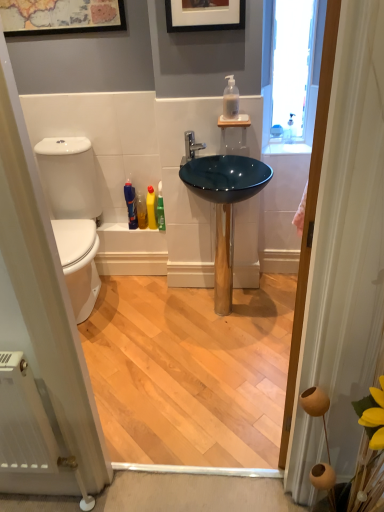
Question: Considering the positions of translucent glass soap dispenser at upper right and translucent plastic bottles at lower center, placed as the 4th toiletry when sorted from right to left, in the image, is translucent glass soap dispenser at upper right bigger or smaller than translucent plastic bottles at lower center, placed as the 4th toiletry when sorted from right to left,?

Choices:
 (A) small
 (B) big

Answer: (B)

Question: From the image's perspective, relative to translucent plastic bottles at lower center, which is counted as the first toiletry, starting from the left, is translucent glass soap dispenser at upper right above or below?

Choices:
 (A) below
 (B) above

Answer: (B)

Question: Which is nearer to the yellow plastic bottle at lower center, which is the 2th toiletry from right to left?

Choices:
 (A) translucent plastic bottles at lower center, which is counted as the first toiletry, starting from the left
 (B) green glossy bottle at center, which is the 4th toiletry from left to right
 (C) polished chrome faucet at center
 (D) translucent plastic soap dispenser at upper center
 (E) translucent glass soap dispenser at upper right

Answer: (B)

Question: Estimate the real-world distances between objects in this image. Which object is farther from the translucent plastic soap dispenser at upper center?

Choices:
 (A) polished chrome faucet at center
 (B) yellow plastic bottle at lower center, the 3th toiletry positioned from the left
 (C) translucent plastic bottles at lower center, which is counted as the first toiletry, starting from the left
 (D) wooden door at right
 (E) white glossy toilet at left

Answer: (D)